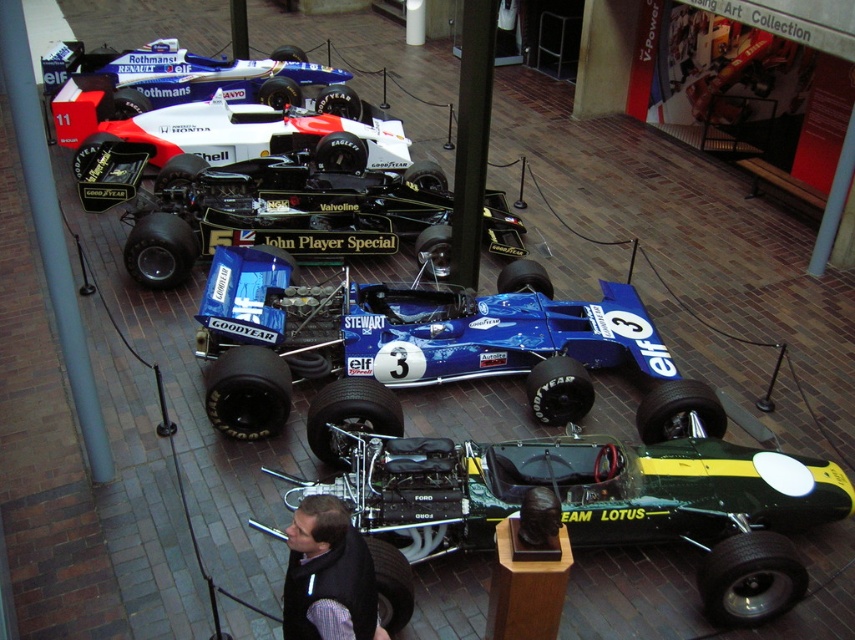
Is green metallic race car at center closer to camera compared to blue glossy race car at center?

Yes, it is in front of blue glossy race car at center.

Can you confirm if green metallic race car at center is positioned above blue glossy race car at center?

Incorrect, green metallic race car at center is not positioned above blue glossy race car at center.

Identify the location of green metallic race car at center. point(588,506).

Who is positioned more to the left, blue glossy race car at center or dark gray vest at center?

dark gray vest at center

Can you confirm if blue glossy race car at center is positioned to the right of dark gray vest at center?

Indeed, blue glossy race car at center is positioned on the right side of dark gray vest at center.

Which is in front, point (434, 326) or point (342, 560)?

Positioned in front is point (342, 560).

This screenshot has height=640, width=855. In order to click on blue glossy race car at center in this screenshot , I will do `click(417, 349)`.

Is green metallic race car at center closer to camera compared to dark gray vest at center?

That is False.

Which of these two, green metallic race car at center or dark gray vest at center, stands shorter?

dark gray vest at center is shorter.

Between point (716, 452) and point (363, 616), which one is positioned behind?

Point (716, 452)

The image size is (855, 640). Find the location of `green metallic race car at center`. green metallic race car at center is located at coordinates (588, 506).